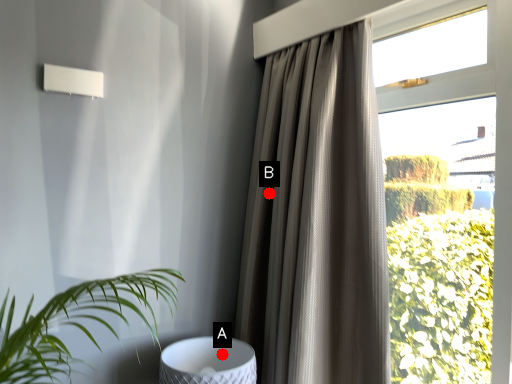
Question: Two points are circled on the image, labeled by A and B beside each circle. Among these points, which one is nearest to the camera?

Choices:
 (A) A is closer
 (B) B is closer

Answer: (A)